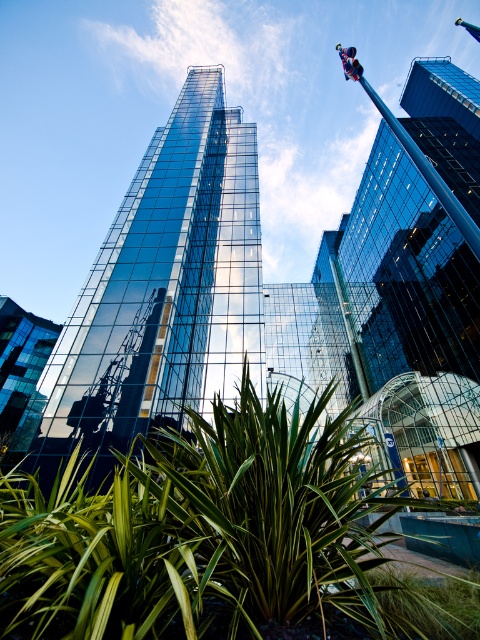
You are standing in the middle of a city square and see the glossy glass tower at center and the glassy steel tower at center. Which one is positioned to the left?

The glossy glass tower at center is positioned to the left of the glassy steel tower at center.

You are standing in the middle of the urban landscape and notice the green leafy plant at center and the glossy glass tower at center. Which object is positioned more to the right side from your viewpoint?

The green leafy plant at center is positioned more to the right side from your viewpoint compared to the glossy glass tower at center.